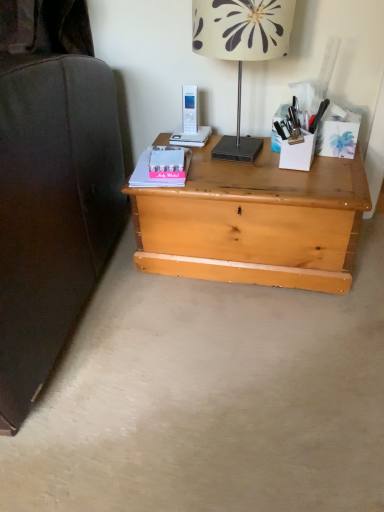
In order to face white plastic pen holder at upper right, should I rotate leftwards or rightwards?

You should rotate right by 14.136 degrees.

The height and width of the screenshot is (512, 384). Describe the element at coordinates (241, 49) in the screenshot. I see `white floral lampshade at upper center` at that location.

Where is `matte pink paperback book at center, which is the first paperback book in front-to-back order`? The width and height of the screenshot is (384, 512). matte pink paperback book at center, which is the first paperback book in front-to-back order is located at coordinates (149, 175).

I want to click on pink matte paperback book at center, placed as the 2th paperback book when sorted from front to back, so click(x=169, y=162).

Based on the photo, is light wood chest at center far away from matte pink paperback book at center, which is the first paperback book in front-to-back order?

They are positioned close to each other.

Which object is positioned more to the left, light wood chest at center or matte pink paperback book at center, the second paperback book from the back?

matte pink paperback book at center, the second paperback book from the back.

From a real-world perspective, is light wood chest at center physically located above or below matte pink paperback book at center, the second paperback book from the back?

Clearly, from a real-world perspective, light wood chest at center is below matte pink paperback book at center, the second paperback book from the back.

From the picture: From the image's perspective, who appears lower, light wood chest at center or matte pink paperback book at center, which is the first paperback book in front-to-back order?

light wood chest at center appears lower in the image.

Can you confirm if matte pink paperback book at center, which is the first paperback book in front-to-back order, is taller than white floral lampshade at upper center?

In fact, matte pink paperback book at center, which is the first paperback book in front-to-back order, may be shorter than white floral lampshade at upper center.

From a real-world perspective, is matte pink paperback book at center, which is the first paperback book in front-to-back order, below white floral lampshade at upper center?

Correct, in the physical world, matte pink paperback book at center, which is the first paperback book in front-to-back order, is lower than white floral lampshade at upper center.

Considering the positions of point (146, 157) and point (218, 16), is point (146, 157) closer or farther from the camera than point (218, 16)?

Clearly, point (146, 157) is more distant from the camera than point (218, 16).

Based on the photo, is light wood chest at center facing away from white plastic pen holder at upper right?

light wood chest at center does not have its back to white plastic pen holder at upper right.

Considering the relative sizes of light wood chest at center and white plastic pen holder at upper right in the image provided, is light wood chest at center shorter than white plastic pen holder at upper right?

No, light wood chest at center is not shorter than white plastic pen holder at upper right.

Are light wood chest at center and white plastic pen holder at upper right far apart?

light wood chest at center is actually quite close to white plastic pen holder at upper right.

Is light wood chest at center not inside white plastic pen holder at upper right?

Answer: light wood chest at center is positioned outside white plastic pen holder at upper right.

Is white floral lampshade at upper center aimed at matte pink paperback book at center, the second paperback book from the back?

No, white floral lampshade at upper center is not facing towards matte pink paperback book at center, the second paperback book from the back.

Which is closer to the camera, (242, 161) or (147, 150)?

Point (242, 161) is positioned closer to the camera compared to point (147, 150).

Is white floral lampshade at upper center positioned beyond the bounds of matte pink paperback book at center, the second paperback book from the back?

Yes, white floral lampshade at upper center is located beyond the bounds of matte pink paperback book at center, the second paperback book from the back.

Can you confirm if white floral lampshade at upper center is thinner than matte pink paperback book at center, which is the first paperback book in front-to-back order?

In fact, white floral lampshade at upper center might be wider than matte pink paperback book at center, which is the first paperback book in front-to-back order.

From a real-world perspective, is pink matte paperback book at center, placed as the 2th paperback book when sorted from front to back, above or below white plastic pen holder at upper right?

In terms of real-world spatial position, pink matte paperback book at center, placed as the 2th paperback book when sorted from front to back, is below white plastic pen holder at upper right.

How distant is pink matte paperback book at center, placed as the 2th paperback book when sorted from front to back, from white plastic pen holder at upper right?

pink matte paperback book at center, placed as the 2th paperback book when sorted from front to back, and white plastic pen holder at upper right are 12.02 inches apart.

Is pink matte paperback book at center, the first paperback book when ordered from back to front, facing away from white plastic pen holder at upper right?

No, pink matte paperback book at center, the first paperback book when ordered from back to front, is not facing away from white plastic pen holder at upper right.

Which object is positioned more to the right, white plastic pen holder at upper right or light wood chest at center?

white plastic pen holder at upper right is more to the right.

How different are the orientations of white plastic pen holder at upper right and light wood chest at center in degrees?

7.52 degrees.

Which point is more distant from viewer, (297, 121) or (346, 259)?

The point (297, 121) is more distant.

Where is `stationery above the light wood chest at center (from a real-world perspective)`? stationery above the light wood chest at center (from a real-world perspective) is located at coordinates (287, 123).

The width and height of the screenshot is (384, 512). In order to click on the 1st paperback book to the left of the white plastic phone at upper center, starting your count from the anchor in this screenshot , I will do `click(169, 162)`.

Is pink matte paperback book at center, the first paperback book when ordered from back to front, wider than white plastic phone at upper center?

Yes, pink matte paperback book at center, the first paperback book when ordered from back to front, is wider than white plastic phone at upper center.

Considering the relative sizes of pink matte paperback book at center, the first paperback book when ordered from back to front, and white plastic phone at upper center in the image provided, is pink matte paperback book at center, the first paperback book when ordered from back to front, shorter than white plastic phone at upper center?

Indeed, pink matte paperback book at center, the first paperback book when ordered from back to front, has a lesser height compared to white plastic phone at upper center.

Which is more to the left, pink matte paperback book at center, the first paperback book when ordered from back to front, or white plastic phone at upper center?

Positioned to the left is pink matte paperback book at center, the first paperback book when ordered from back to front.

The height and width of the screenshot is (512, 384). Find the location of `desk beneath the matte pink paperback book at center, the second paperback book from the back (from a real-world perspective)`. desk beneath the matte pink paperback book at center, the second paperback book from the back (from a real-world perspective) is located at coordinates (255, 222).

This screenshot has height=512, width=384. Find the location of `the 2nd paperback book positioned below the white floral lampshade at upper center (from the image's perspective)`. the 2nd paperback book positioned below the white floral lampshade at upper center (from the image's perspective) is located at coordinates (149, 175).

When comparing their distances from pink matte paperback book at center, the first paperback book when ordered from back to front, does light wood chest at center or white plastic phone at upper center seem closer?

white plastic phone at upper center is positioned closer to the anchor pink matte paperback book at center, the first paperback book when ordered from back to front.

When comparing their distances from pink matte paperback book at center, the first paperback book when ordered from back to front, does matte pink paperback book at center, the second paperback book from the back, or white plastic pen holder at upper right seem closer?

Based on the image, matte pink paperback book at center, the second paperback book from the back, appears to be nearer to pink matte paperback book at center, the first paperback book when ordered from back to front.

From the picture: Estimate the real-world distances between objects in this image. Which object is further from pink matte paperback book at center, the first paperback book when ordered from back to front, white floral lampshade at upper center or white plastic phone at upper center?

Among the two, white floral lampshade at upper center is located further to pink matte paperback book at center, the first paperback book when ordered from back to front.

Which object lies nearer to the anchor point pink matte paperback book at center, the first paperback book when ordered from back to front, white plastic phone at upper center or matte pink paperback book at center, which is the first paperback book in front-to-back order?

matte pink paperback book at center, which is the first paperback book in front-to-back order.

Looking at the image, which one is located closer to white floral lampshade at upper center, white plastic pen holder at upper right or matte pink paperback book at center, which is the first paperback book in front-to-back order?

white plastic pen holder at upper right is positioned closer to the anchor white floral lampshade at upper center.

Considering their positions, is white plastic phone at upper center positioned further to matte pink paperback book at center, which is the first paperback book in front-to-back order, than light wood chest at center?

light wood chest at center lies further to matte pink paperback book at center, which is the first paperback book in front-to-back order, than the other object.

Which object lies further to the anchor point white plastic phone at upper center, pink matte paperback book at center, the first paperback book when ordered from back to front, or matte pink paperback book at center, the second paperback book from the back?

matte pink paperback book at center, the second paperback book from the back, lies further to white plastic phone at upper center than the other object.

Based on their spatial positions, is white floral lampshade at upper center or white plastic pen holder at upper right further from pink matte paperback book at center, placed as the 2th paperback book when sorted from front to back?

white plastic pen holder at upper right lies further to pink matte paperback book at center, placed as the 2th paperback book when sorted from front to back, than the other object.

Where is `lamp situated between pink matte paperback book at center, the first paperback book when ordered from back to front, and white plastic pen holder at upper right from left to right`? lamp situated between pink matte paperback book at center, the first paperback book when ordered from back to front, and white plastic pen holder at upper right from left to right is located at coordinates (241, 49).

The height and width of the screenshot is (512, 384). I want to click on stationery between white floral lampshade at upper center and white plastic phone at upper center along the z-axis, so click(287, 123).

Where is `paperback book that lies between white plastic phone at upper center and matte pink paperback book at center, which is the first paperback book in front-to-back order, from top to bottom`? The width and height of the screenshot is (384, 512). paperback book that lies between white plastic phone at upper center and matte pink paperback book at center, which is the first paperback book in front-to-back order, from top to bottom is located at coordinates (169, 162).

Identify the location of stationery between white floral lampshade at upper center and light wood chest at center in the up-down direction. (287, 123).